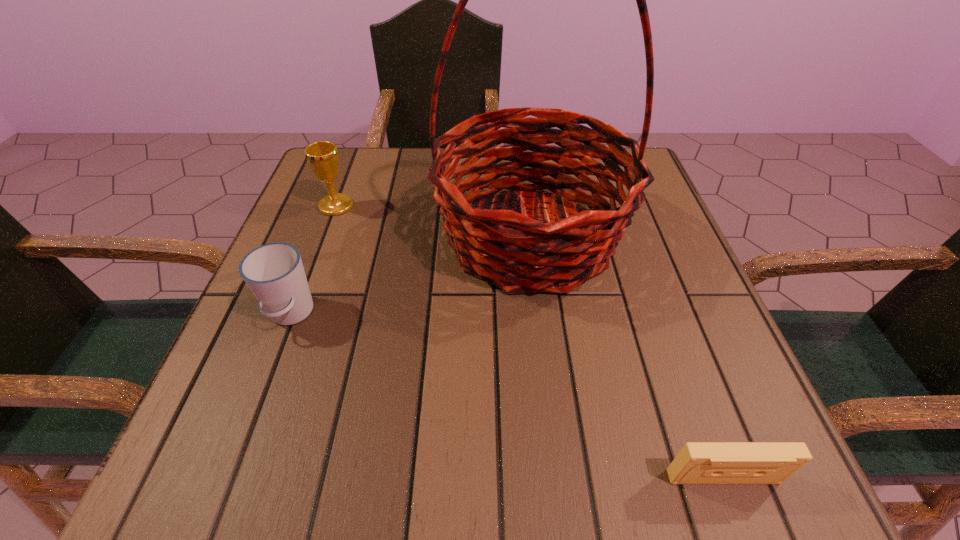
I want to click on object positioned at the near edge, so click(x=698, y=462).

This screenshot has height=540, width=960. Identify the location of chalice positioned at the left edge. (x=322, y=157).

Locate an element on the screen. This screenshot has width=960, height=540. cup located at the left edge is located at coordinates (274, 272).

I want to click on basket present at the right edge, so click(x=533, y=256).

In order to click on videotape that is at the right edge in this screenshot , I will do `click(698, 462)`.

At what (x,y) coordinates should I click in order to perform the action: click on object present at the far left corner. Please return your answer as a coordinate pair (x, y). The height and width of the screenshot is (540, 960). Looking at the image, I should click on (322, 157).

Find the location of a particular element. Image resolution: width=960 pixels, height=540 pixels. object that is at the far right corner is located at coordinates (533, 256).

Locate an element on the screen. object located at the near right corner is located at coordinates (698, 462).

The height and width of the screenshot is (540, 960). Find the location of `vacant space at the far edge of the desktop`. vacant space at the far edge of the desktop is located at coordinates (423, 157).

The height and width of the screenshot is (540, 960). Identify the location of vacant space at the near edge of the desktop. (620, 443).